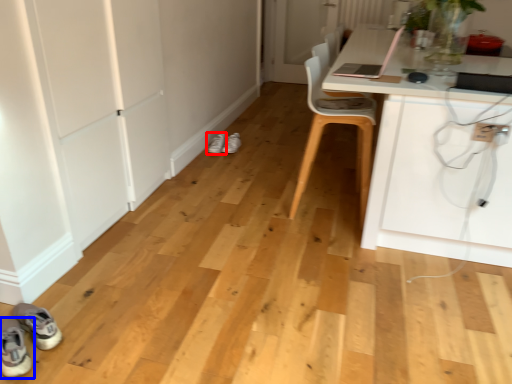
Question: Which object is further to the camera taking this photo, footwear (highlighted by a red box) or footwear (highlighted by a blue box)?

Choices:
 (A) footwear
 (B) footwear

Answer: (A)